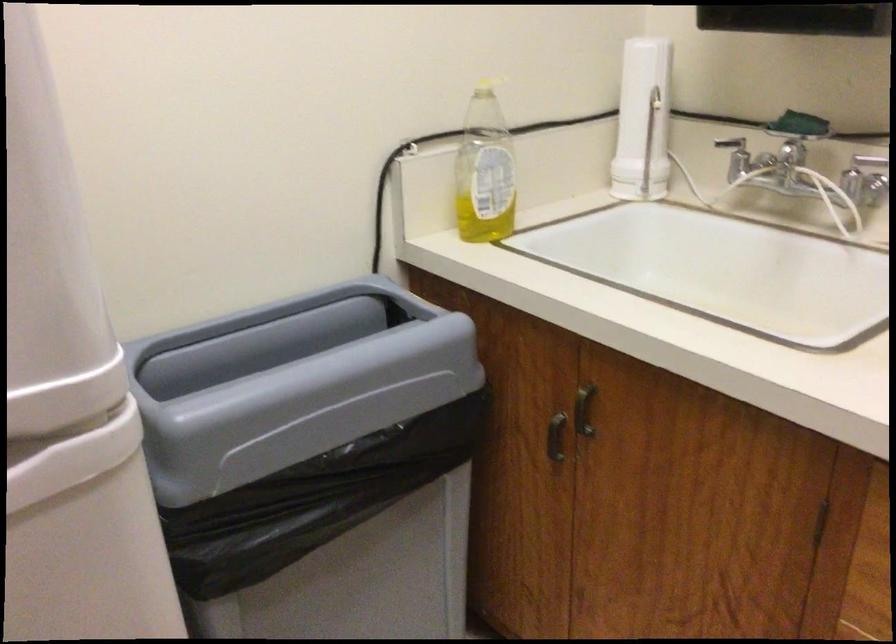
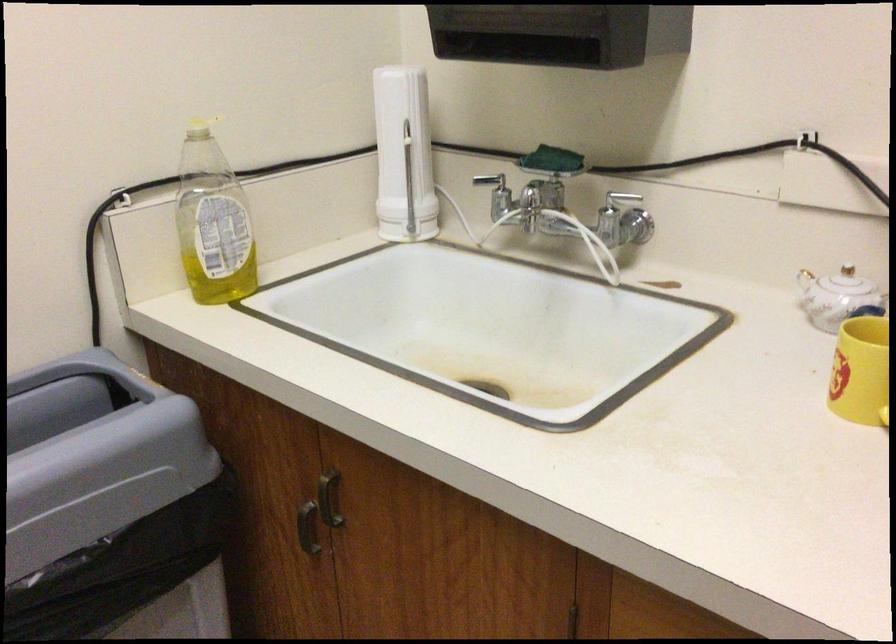
Where in the second image is the point corresponding to point 737,156 from the first image?

(496, 194)